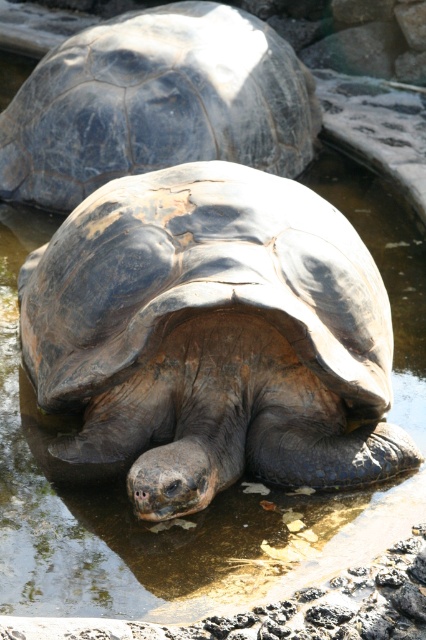
From the picture: You are a wildlife researcher observing the two tortoises in the shallow pool. Which tortoise has a taller height between the leathery brown tortoise at center and the dark gray textured shell at center?

The leathery brown tortoise at center has a greater height compared to the dark gray textured shell at center.

In the scene shown: You are a wildlife researcher observing the two tortoises in the shallow pool. Which tortoise, the leathery brown tortoise at center or the dark gray textured shell at center, has a bigger size?

The leathery brown tortoise at center is larger in size than the dark gray textured shell at center.

You are standing next to a 2.5 meter long boat and want to place the leathery brown tortoise at center on it. Will the tortoise fit entirely on the boat?

The leathery brown tortoise at center is 2.92 meters away from the camera, but this distance does not indicate its size. Therefore, we cannot determine if it will fit on the 2.5 meter long boat.